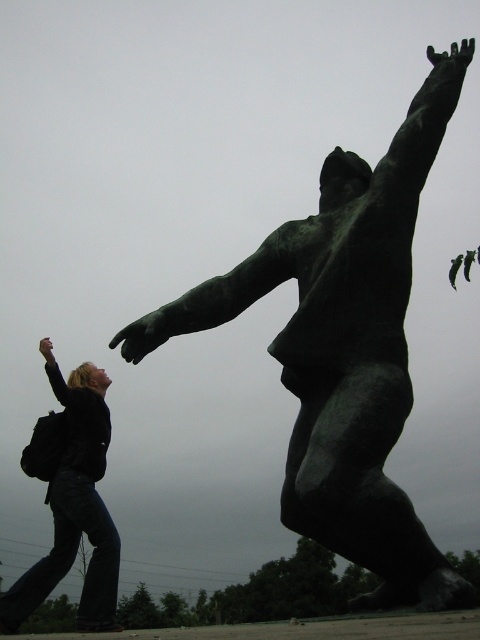
Question: Which point is farther from the camera taking this photo?

Choices:
 (A) (297, 419)
 (B) (115, 570)

Answer: (B)

Question: Is green patina bronze statue at center above dark blue jeans at lower left?

Choices:
 (A) yes
 (B) no

Answer: (A)

Question: Which object is farther from the camera taking this photo?

Choices:
 (A) dark blue jeans at lower left
 (B) green patina bronze statue at center

Answer: (A)

Question: Can you confirm if green patina bronze statue at center is smaller than dark blue jeans at lower left?

Choices:
 (A) no
 (B) yes

Answer: (A)

Question: Which point is closer to the camera?

Choices:
 (A) (333, 321)
 (B) (23, 609)

Answer: (A)

Question: Can you confirm if green patina bronze statue at center is wider than dark blue jeans at lower left?

Choices:
 (A) no
 (B) yes

Answer: (B)